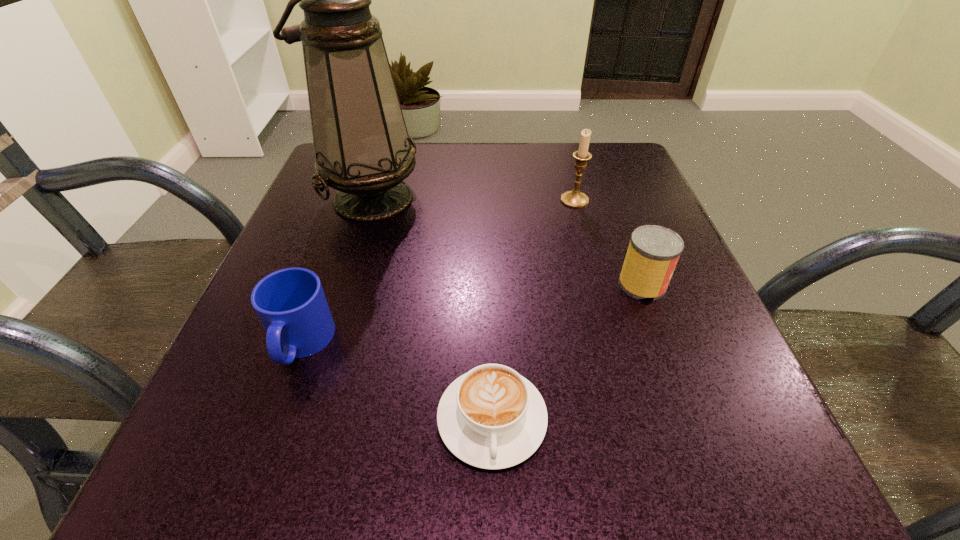
Find the location of a particular element. object that is at the far right corner is located at coordinates (575, 199).

Find the location of a particular element. vacant space at the far edge is located at coordinates (555, 144).

Find the location of a particular element. free location at the left edge of the desktop is located at coordinates (346, 325).

You are a GUI agent. You are given a task and a screenshot of the screen. Output one action in this format:
    pyautogui.click(x=<x>, y=<y>)
    Task: Click on the vacant space at the right edge
    The width and height of the screenshot is (960, 540).
    Given the screenshot: What is the action you would take?
    tap(622, 215)

Locate an element on the screen. This screenshot has width=960, height=540. free space at the near left corner of the desktop is located at coordinates (185, 454).

What are the coordinates of `vacant area at the far right corner of the desktop` in the screenshot? It's located at (614, 170).

Identify the location of vacant space at the near right corner of the desktop. The height and width of the screenshot is (540, 960). (762, 463).

Locate an element on the screen. The height and width of the screenshot is (540, 960). unoccupied area between the second tallest object and the oil lamp is located at coordinates (473, 199).

Image resolution: width=960 pixels, height=540 pixels. What are the coordinates of `vacant area that lies between the third object from left to right and the tallest object` in the screenshot? It's located at (432, 308).

Identify the location of empty space between the mug and the oil lamp. (336, 271).